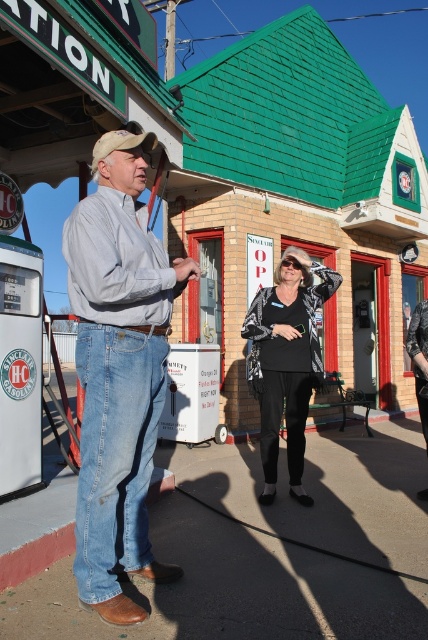
Question: Does denim jeans at left lie behind metallic silver jacket at center?

Choices:
 (A) yes
 (B) no

Answer: (B)

Question: Which point appears farthest from the camera in this image?

Choices:
 (A) (297, 291)
 (B) (101, 568)

Answer: (A)

Question: Which point is closer to the camera?

Choices:
 (A) (89, 301)
 (B) (262, 444)

Answer: (A)

Question: Which object appears farthest from the camera in this image?

Choices:
 (A) metallic silver jacket at center
 (B) denim jeans at left

Answer: (A)

Question: Is denim jeans at left behind metallic silver jacket at center?

Choices:
 (A) yes
 (B) no

Answer: (B)

Question: Does denim jeans at left appear on the right side of metallic silver jacket at center?

Choices:
 (A) no
 (B) yes

Answer: (A)